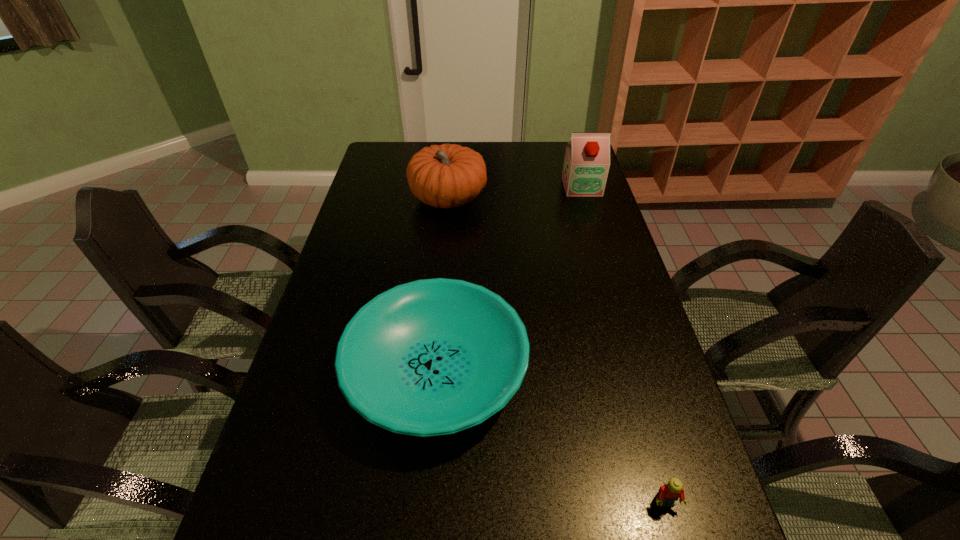
Find the location of a particular element. soya milk is located at coordinates (586, 165).

I want to click on the third shortest object, so click(x=446, y=176).

Locate an element on the screen. dish is located at coordinates (430, 357).

At what (x,y) coordinates should I click in order to perform the action: click on the nearest object. Please return your answer as a coordinate pair (x, y). The width and height of the screenshot is (960, 540). Looking at the image, I should click on (669, 493).

At what (x,y) coordinates should I click in order to perform the action: click on the shortest object. Please return your answer as a coordinate pair (x, y). Image resolution: width=960 pixels, height=540 pixels. Looking at the image, I should click on (669, 493).

At what (x,y) coordinates should I click in order to perform the action: click on free space located 0.190m with the cap open on the soya milk. Please return your answer as a coordinate pair (x, y). This screenshot has height=540, width=960. Looking at the image, I should click on (594, 228).

Identify the location of free location located on the back of the pumpkin. (452, 158).

This screenshot has height=540, width=960. Find the location of `vacant space located on the right of the third farthest object`. vacant space located on the right of the third farthest object is located at coordinates (658, 370).

Locate an element on the screen. The height and width of the screenshot is (540, 960). object at the left edge is located at coordinates (430, 357).

Locate an element on the screen. The image size is (960, 540). soya milk located in the right edge section of the desktop is located at coordinates (586, 165).